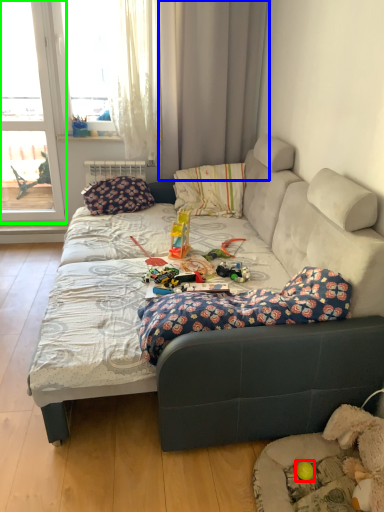
Question: Which object is the farthest from toy (highlighted by a red box)? Choose among these: curtain (highlighted by a blue box) or window (highlighted by a green box).

Choices:
 (A) curtain
 (B) window

Answer: (B)